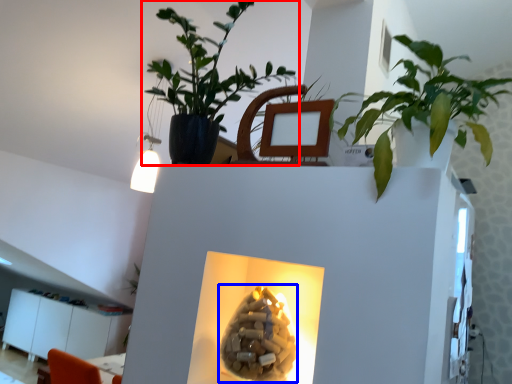
Question: Among these objects, which one is farthest to the camera, houseplant (highlighted by a red box) or flower (highlighted by a blue box)?

Choices:
 (A) houseplant
 (B) flower

Answer: (A)